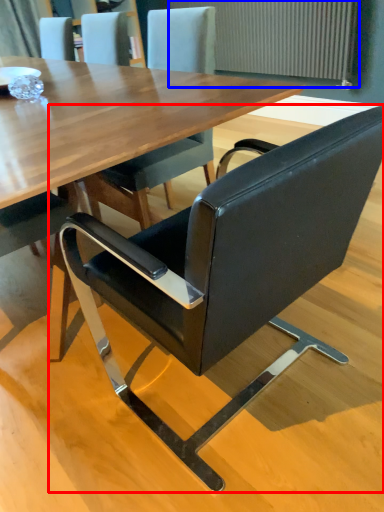
Question: Which point is further to the camera, chair (highlighted by a red box) or radiator (highlighted by a blue box)?

Choices:
 (A) chair
 (B) radiator

Answer: (B)